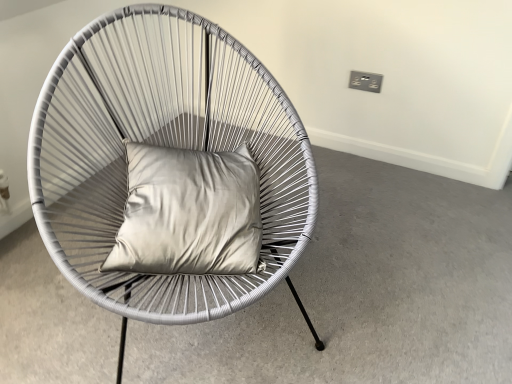
Where is `vacant area that lies to the right of white woven chair at center`? vacant area that lies to the right of white woven chair at center is located at coordinates (386, 267).